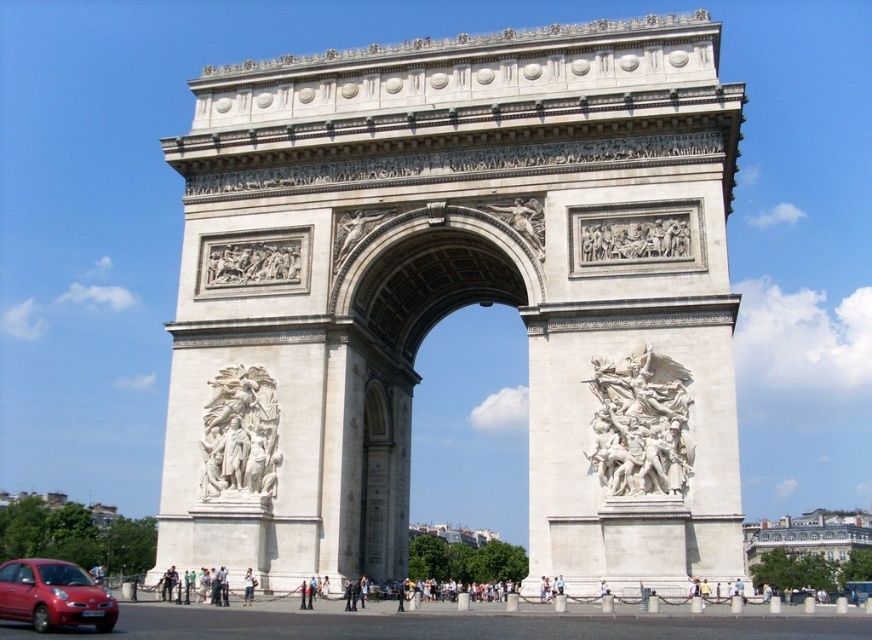
Question: Is white marble sculpture at center below matte red car at lower left?

Choices:
 (A) no
 (B) yes

Answer: (A)

Question: Is white stone arch at center smaller than white marble relief at center?

Choices:
 (A) no
 (B) yes

Answer: (A)

Question: Is white stone arch at center below white marble sculpture at center?

Choices:
 (A) yes
 (B) no

Answer: (A)

Question: Which of the following is the farthest from the observer?

Choices:
 (A) (257, 461)
 (B) (623, 314)
 (C) (669, 492)
 (D) (246, 568)

Answer: (A)

Question: Which of the following is the closest to the observer?

Choices:
 (A) light brown leather jacket at center
 (B) white marble sculpture at center
 (C) white marble relief at center

Answer: (A)

Question: Among these points, which one is farthest from the camera?

Choices:
 (A) (344, 394)
 (B) (244, 596)
 (C) (597, 449)
 (D) (14, 579)

Answer: (A)